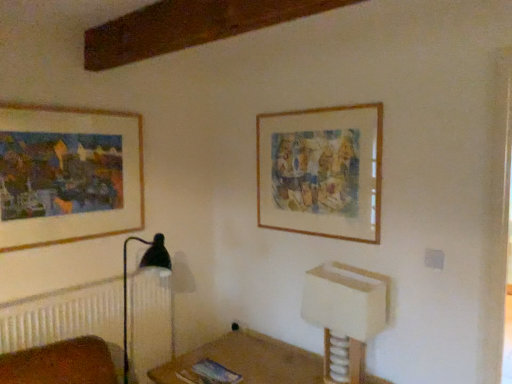
Question: Is white plastic vanity at lower right far from wooden picture frame at upper left, which appears as the 2th picture frame when viewed from the right?

Choices:
 (A) no
 (B) yes

Answer: (B)

Question: Is white plastic vanity at lower right placed right next to wooden picture frame at upper left, arranged as the first picture frame when viewed from the left?

Choices:
 (A) no
 (B) yes

Answer: (A)

Question: Does white plastic vanity at lower right turn towards wooden picture frame at upper left, which appears as the 2th picture frame when viewed from the right?

Choices:
 (A) yes
 (B) no

Answer: (B)

Question: Is white plastic vanity at lower right not inside wooden picture frame at upper left, arranged as the first picture frame when viewed from the left?

Choices:
 (A) no
 (B) yes

Answer: (B)

Question: Can you confirm if white plastic vanity at lower right is bigger than wooden picture frame at upper left, which appears as the 2th picture frame when viewed from the right?

Choices:
 (A) yes
 (B) no

Answer: (A)

Question: From a real-world perspective, is wooden picture frame at upper left, arranged as the first picture frame when viewed from the left, above or below white plastic vanity at lower right?

Choices:
 (A) above
 (B) below

Answer: (A)

Question: Is wooden picture frame at upper left, arranged as the first picture frame when viewed from the left, in front of or behind white plastic vanity at lower right in the image?

Choices:
 (A) front
 (B) behind

Answer: (B)

Question: Based on their sizes in the image, would you say wooden picture frame at upper left, which appears as the 2th picture frame when viewed from the right, is bigger or smaller than white plastic vanity at lower right?

Choices:
 (A) big
 (B) small

Answer: (B)

Question: From their relative heights in the image, would you say wooden picture frame at upper left, which appears as the 2th picture frame when viewed from the right, is taller or shorter than white plastic vanity at lower right?

Choices:
 (A) tall
 (B) short

Answer: (A)

Question: Relative to wooden picture frame at upper left, which appears as the 2th picture frame when viewed from the right, is wooden frame at upper right, arranged as the 2th picture frame when viewed from the left, in front or behind?

Choices:
 (A) behind
 (B) front

Answer: (A)

Question: From the image's perspective, is wooden frame at upper right, arranged as the 2th picture frame when viewed from the left, located above or below wooden picture frame at upper left, arranged as the first picture frame when viewed from the left?

Choices:
 (A) below
 (B) above

Answer: (B)

Question: Considering the relative positions of wooden frame at upper right, arranged as the 2th picture frame when viewed from the left, and wooden picture frame at upper left, arranged as the first picture frame when viewed from the left, in the image provided, is wooden frame at upper right, arranged as the 2th picture frame when viewed from the left, to the left or to the right of wooden picture frame at upper left, arranged as the first picture frame when viewed from the left,?

Choices:
 (A) left
 (B) right

Answer: (B)

Question: Is wooden frame at upper right, arranged as the 1th picture frame when viewed from the right, inside or outside of wooden picture frame at upper left, arranged as the first picture frame when viewed from the left?

Choices:
 (A) outside
 (B) inside

Answer: (A)

Question: Is wooden frame at upper right, arranged as the 2th picture frame when viewed from the left, inside the boundaries of white plastic vanity at lower right, or outside?

Choices:
 (A) inside
 (B) outside

Answer: (B)

Question: In terms of height, does wooden frame at upper right, arranged as the 1th picture frame when viewed from the right, look taller or shorter compared to white plastic vanity at lower right?

Choices:
 (A) tall
 (B) short

Answer: (A)